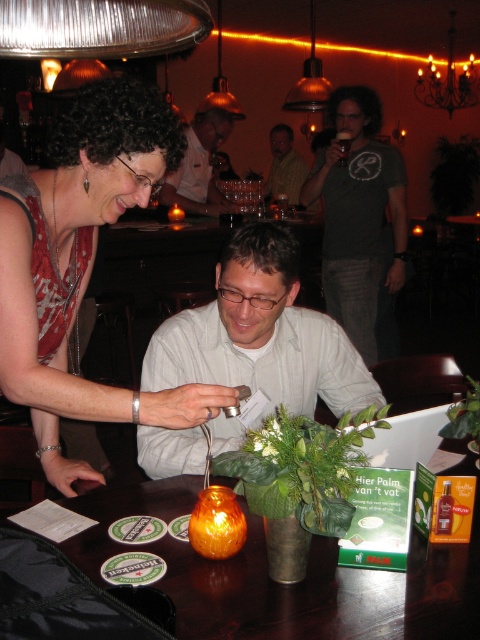
Question: Does white matte shirt at center appear under dark gray t-shirt at upper center?

Choices:
 (A) no
 (B) yes

Answer: (B)

Question: Is dark gray t-shirt at upper center smaller than metallic gold pendant light at upper center?

Choices:
 (A) no
 (B) yes

Answer: (A)

Question: Which object is positioned farthest from the matte red dress at upper left?

Choices:
 (A) dark gray t-shirt at upper center
 (B) white matte shirt at center

Answer: (A)

Question: Is matte red dress at upper left to the left of translucent orange glass vase at center from the viewer's perspective?

Choices:
 (A) no
 (B) yes

Answer: (B)

Question: Which of the following is the farthest from the observer?

Choices:
 (A) [x=219, y=22]
 (B) [x=212, y=200]
 (C) [x=404, y=280]
 (D) [x=283, y=372]

Answer: (A)

Question: Which point is closer to the camera taking this photo?

Choices:
 (A) (361, 294)
 (B) (305, 348)
 (C) (82, 541)

Answer: (C)